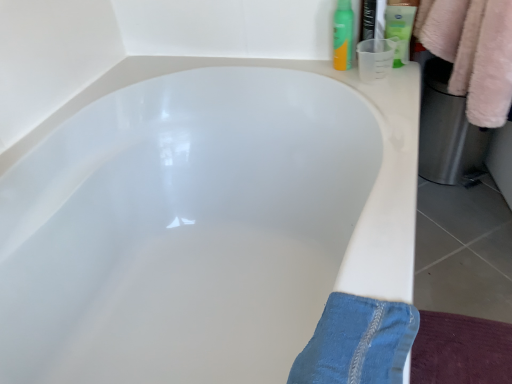
Question: From the image's perspective, is denim at lower right above green matte lotion at upper right, acting as the second toiletry starting from the left?

Choices:
 (A) yes
 (B) no

Answer: (B)

Question: From a real-world perspective, is denim at lower right positioned over green matte lotion at upper right, acting as the 1th toiletry starting from the right, based on gravity?

Choices:
 (A) no
 (B) yes

Answer: (A)

Question: Is denim at lower right positioned before green matte lotion at upper right, acting as the second toiletry starting from the left?

Choices:
 (A) yes
 (B) no

Answer: (A)

Question: Is denim at lower right looking in the opposite direction of green matte lotion at upper right, acting as the second toiletry starting from the left?

Choices:
 (A) no
 (B) yes

Answer: (A)

Question: Is denim at lower right to the left of green matte lotion at upper right, acting as the second toiletry starting from the left, from the viewer's perspective?

Choices:
 (A) no
 (B) yes

Answer: (B)

Question: Considering the positions of denim at lower right and white glossy bathtub at center in the image, is denim at lower right wider or thinner than white glossy bathtub at center?

Choices:
 (A) thin
 (B) wide

Answer: (A)

Question: Is denim at lower right taller or shorter than white glossy bathtub at center?

Choices:
 (A) short
 (B) tall

Answer: (A)

Question: Relative to white glossy bathtub at center, is denim at lower right in front or behind?

Choices:
 (A) front
 (B) behind

Answer: (A)

Question: From the image's perspective, is denim at lower right positioned above or below white glossy bathtub at center?

Choices:
 (A) below
 (B) above

Answer: (A)

Question: Is denim at lower right wider or thinner than green matte lotion at upper right, acting as the 1th toiletry starting from the right?

Choices:
 (A) wide
 (B) thin

Answer: (A)

Question: Does point (402, 349) appear closer or farther from the camera than point (396, 1)?

Choices:
 (A) farther
 (B) closer

Answer: (B)

Question: From a real-world perspective, is denim at lower right physically located above or below green matte lotion at upper right, acting as the second toiletry starting from the left?

Choices:
 (A) below
 (B) above

Answer: (A)

Question: In the image, is denim at lower right on the left side or the right side of green matte lotion at upper right, acting as the second toiletry starting from the left?

Choices:
 (A) left
 (B) right

Answer: (A)

Question: From the image's perspective, is white glossy bathtub at center positioned above or below denim at lower right?

Choices:
 (A) above
 (B) below

Answer: (A)

Question: In terms of size, does white glossy bathtub at center appear bigger or smaller than denim at lower right?

Choices:
 (A) big
 (B) small

Answer: (A)